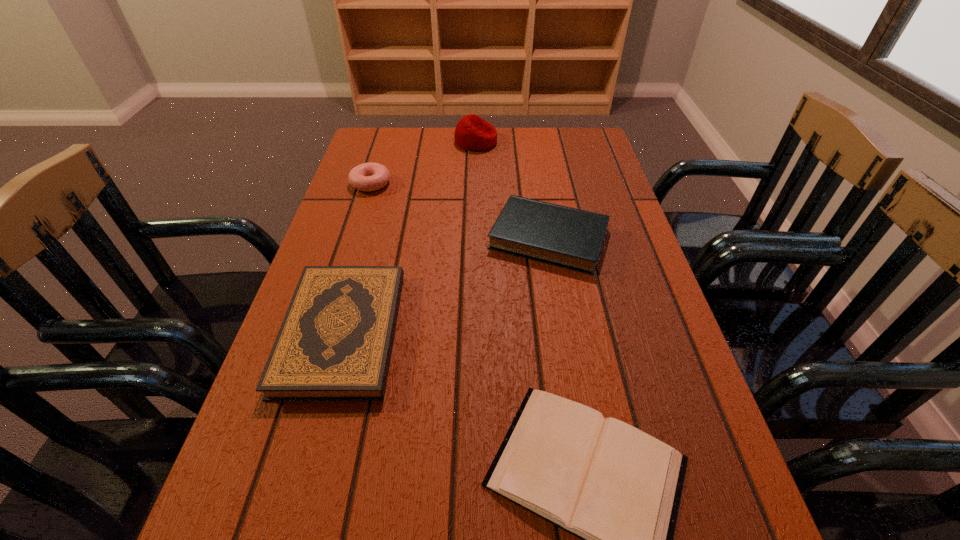
The image size is (960, 540). I want to click on unoccupied area between the leftmost hardback book and the beanbag, so click(409, 237).

The image size is (960, 540). I want to click on vacant area that lies between the second farthest object and the tallest object, so click(x=423, y=162).

Locate an element on the screen. empty space that is in between the beanbag and the doughnut is located at coordinates (423, 162).

Locate which object ranks in proximity to the beanbag. Please provide its 2D coordinates. Your answer should be formatted as a tuple, i.e. [(x, y)], where the tuple contains the x and y coordinates of a point satisfying the conditions above.

[(367, 177)]

The height and width of the screenshot is (540, 960). Find the location of `the closest object to the beanbag`. the closest object to the beanbag is located at coordinates (367, 177).

Find the location of `the second closest hardback book to the farthest hardback book`. the second closest hardback book to the farthest hardback book is located at coordinates (617, 488).

Identify the location of hardback book that is the third closest one to the beanbag. (617, 488).

Where is `vacant region that satisfies the following two spatial constraints: 1. on the seat area of the tallest object; 2. on the left side of the third nearest object`? The height and width of the screenshot is (540, 960). vacant region that satisfies the following two spatial constraints: 1. on the seat area of the tallest object; 2. on the left side of the third nearest object is located at coordinates (474, 238).

At what (x,y) coordinates should I click in order to perform the action: click on free spot that satisfies the following two spatial constraints: 1. on the back side of the farthest hardback book; 2. on the seat area of the tallest object. Please return your answer as a coordinate pair (x, y). The height and width of the screenshot is (540, 960). Looking at the image, I should click on (532, 141).

You are a GUI agent. You are given a task and a screenshot of the screen. Output one action in this format:
    pyautogui.click(x=<x>, y=<y>)
    Task: Click on the vacant space that satisfies the following two spatial constraints: 1. on the seat area of the tallest object; 2. on the back side of the third nearest object
    This screenshot has width=960, height=540.
    Given the screenshot: What is the action you would take?
    pyautogui.click(x=474, y=238)